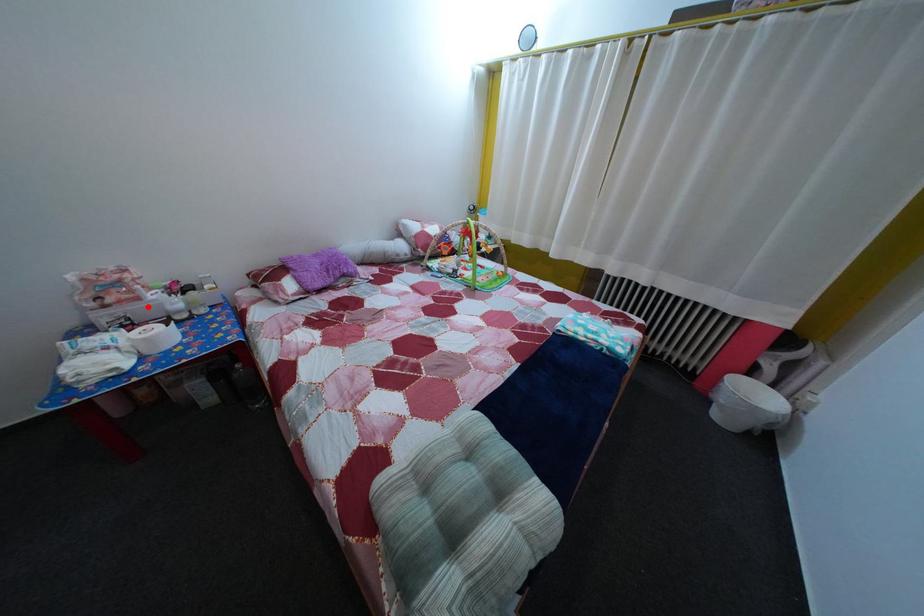
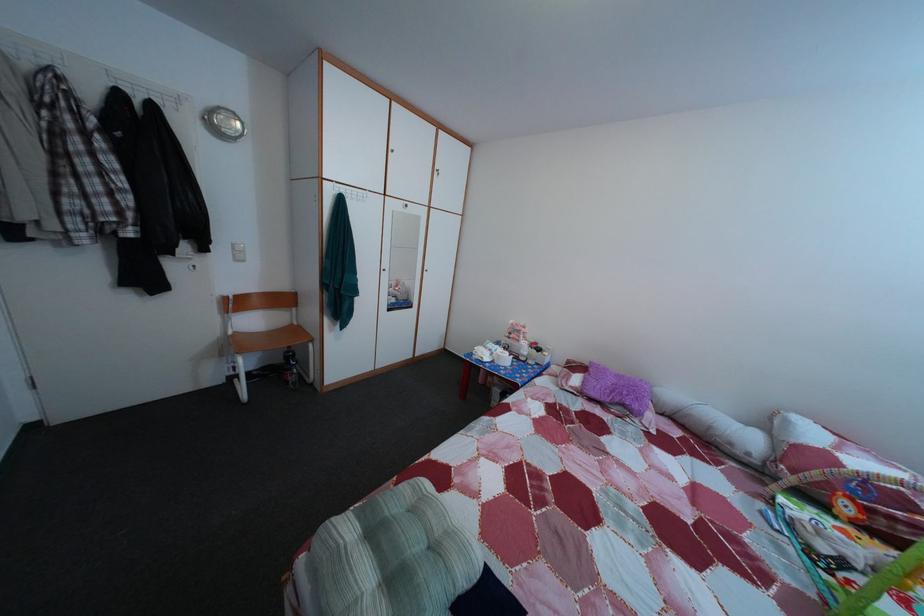
In the second image, find the point that corresponds to the highlighted location in the first image.

(528, 349)